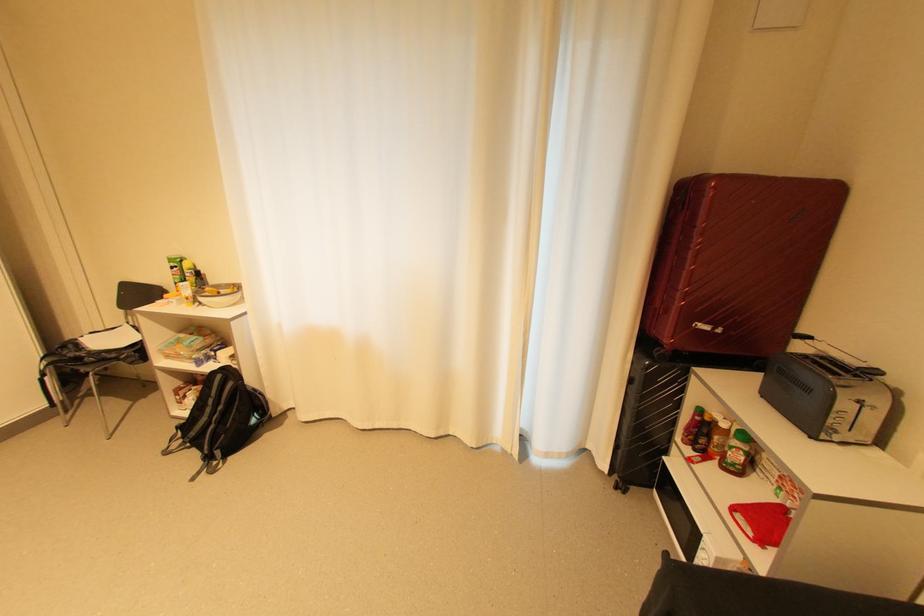
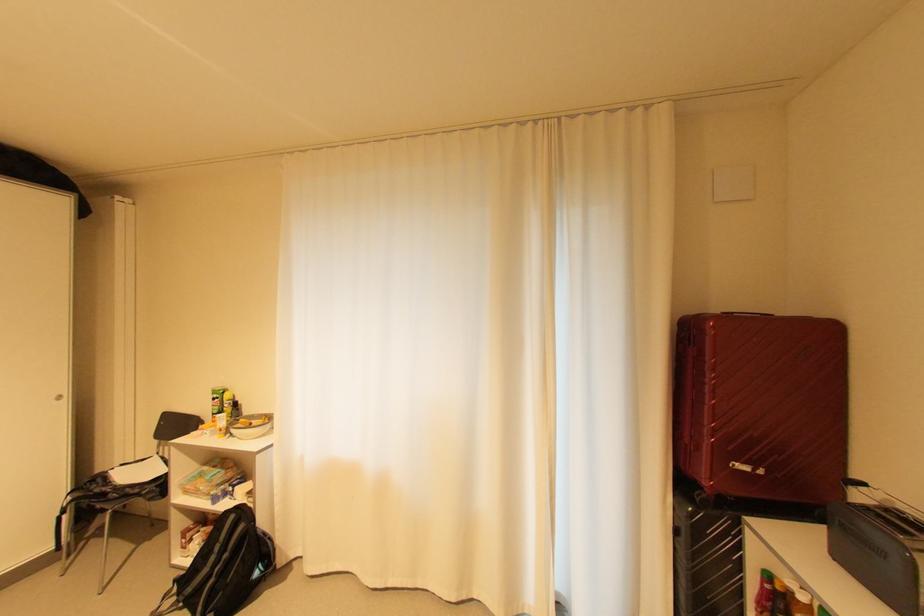
Question: Which direction would the cameraman need to move to produce the second image? Reply with the corresponding letter.

Choices:
 (A) Left
 (B) Right
 (C) Forward
 (D) Backward

Answer: (D)